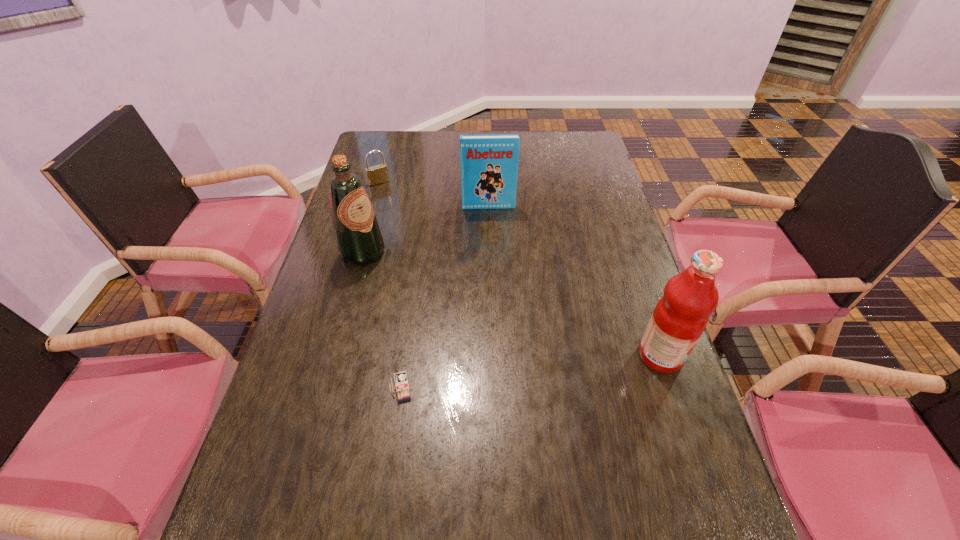
This screenshot has height=540, width=960. Find the location of `vacant space on the desktop that is between the matchbox and the fruit juice and is positioned on the front-facing side of the farthest object`. vacant space on the desktop that is between the matchbox and the fruit juice and is positioned on the front-facing side of the farthest object is located at coordinates (498, 375).

Find the location of a particular element. This screenshot has width=960, height=540. vacant spot on the desktop that is between the third object from right to left and the fruit juice and is positioned on the front-facing side of the third nearest object is located at coordinates (564, 367).

Where is `vacant space on the desktop that is between the third object from left to right and the rightmost object and is positioned on the front cover of the fourth nearest object`? The width and height of the screenshot is (960, 540). vacant space on the desktop that is between the third object from left to right and the rightmost object and is positioned on the front cover of the fourth nearest object is located at coordinates (501, 375).